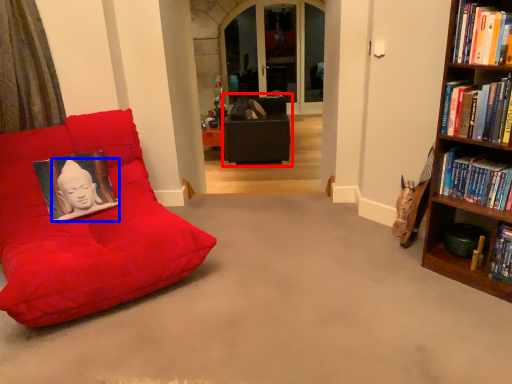
Question: Which of the following is the closest to the observer, bean bag chair (highlighted by a red box) or person (highlighted by a blue box)?

Choices:
 (A) bean bag chair
 (B) person

Answer: (B)